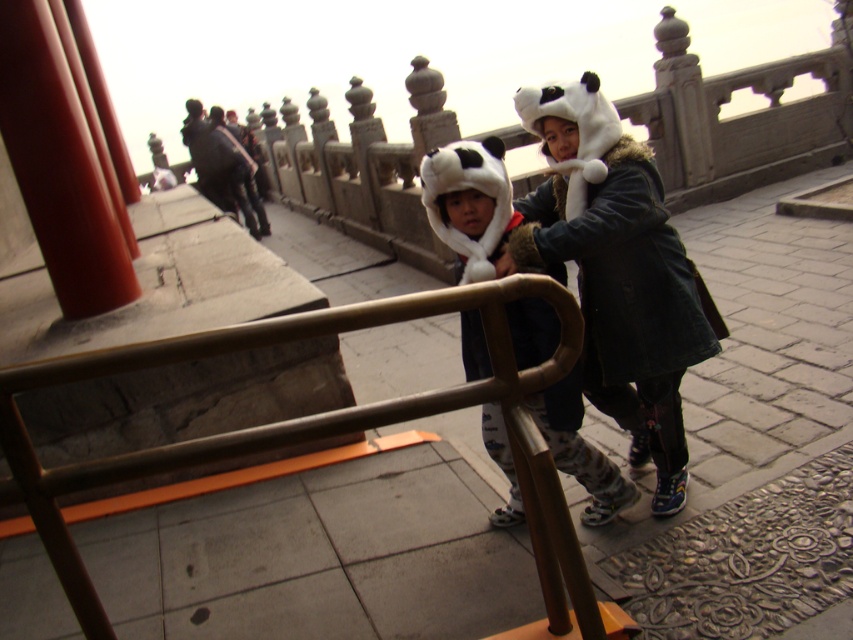
Question: Among these objects, which one is nearest to the camera?

Choices:
 (A) white plush panda hat at center
 (B) metallic rail at center
 (C) white fur hat at center

Answer: (B)

Question: Can you confirm if white fur hat at center is thinner than white plush panda hat at center?

Choices:
 (A) no
 (B) yes

Answer: (A)

Question: Considering the real-world distances, which object is closest to the metallic rail at center?

Choices:
 (A) white fur hat at center
 (B) white plush panda hat at center

Answer: (B)

Question: Is the position of metallic rail at center more distant than that of white plush panda hat at center?

Choices:
 (A) no
 (B) yes

Answer: (A)

Question: Is white fur hat at center to the left of white plush panda hat at center from the viewer's perspective?

Choices:
 (A) no
 (B) yes

Answer: (A)

Question: Estimate the real-world distances between objects in this image. Which object is closer to the white fur hat at center?

Choices:
 (A) white plush panda hat at center
 (B) metallic rail at center

Answer: (A)